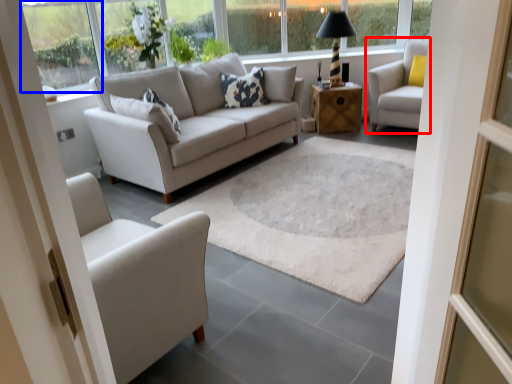
Question: Which point is further to the camera, chair (highlighted by a red box) or window (highlighted by a blue box)?

Choices:
 (A) chair
 (B) window

Answer: (A)